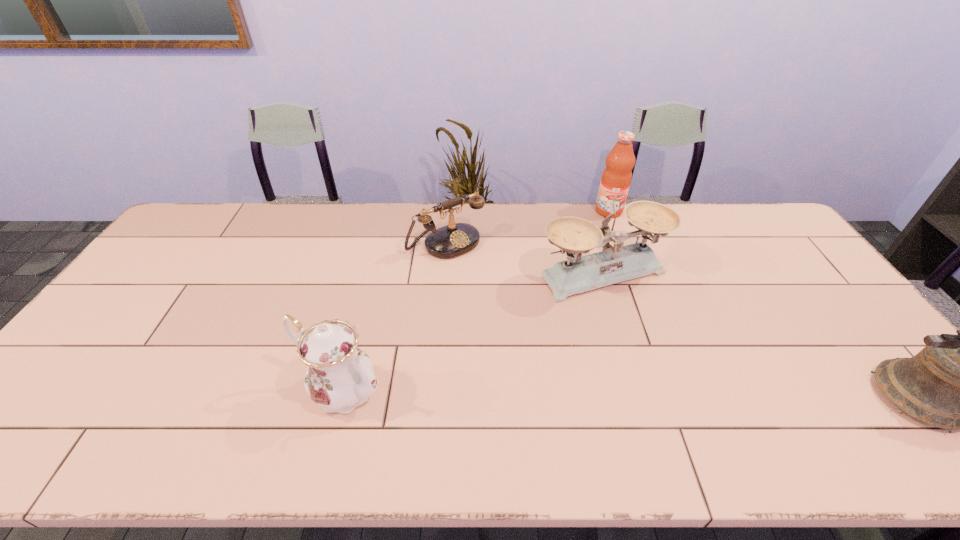
Where is `chinaware`? chinaware is located at coordinates point(339,377).

Where is `the shortest object`? the shortest object is located at coordinates (455, 239).

Locate an element on the screen. This screenshot has width=960, height=540. scale is located at coordinates (573, 235).

You are a GUI agent. You are given a task and a screenshot of the screen. Output one action in this format:
    pyautogui.click(x=<x>, y=<y>)
    Task: Click on the farthest object
    The image size is (960, 540).
    Given the screenshot: What is the action you would take?
    pyautogui.click(x=616, y=177)

At what (x,y) coordinates should I click in order to perform the action: click on the tallest object. Please return your answer as a coordinate pair (x, y). The width and height of the screenshot is (960, 540). Looking at the image, I should click on (616, 177).

You are a GUI agent. You are given a task and a screenshot of the screen. Output one action in this format:
    pyautogui.click(x=<x>, y=<y>)
    Task: Click on the free spot located 0.320m on the right of the chinaware
    The image size is (960, 540).
    Given the screenshot: What is the action you would take?
    pyautogui.click(x=517, y=390)

Identify the location of vacant region located on the dial of the shortest object. (511, 302).

Find the location of a particular element. This screenshot has height=540, width=960. free point located 0.100m on the dial of the shortest object is located at coordinates click(485, 275).

The width and height of the screenshot is (960, 540). I want to click on free space located 0.190m on the dial of the shortest object, so click(x=501, y=292).

Locate an element on the screen. vacant area situated 0.200m on the front-facing side of the scale is located at coordinates (678, 353).